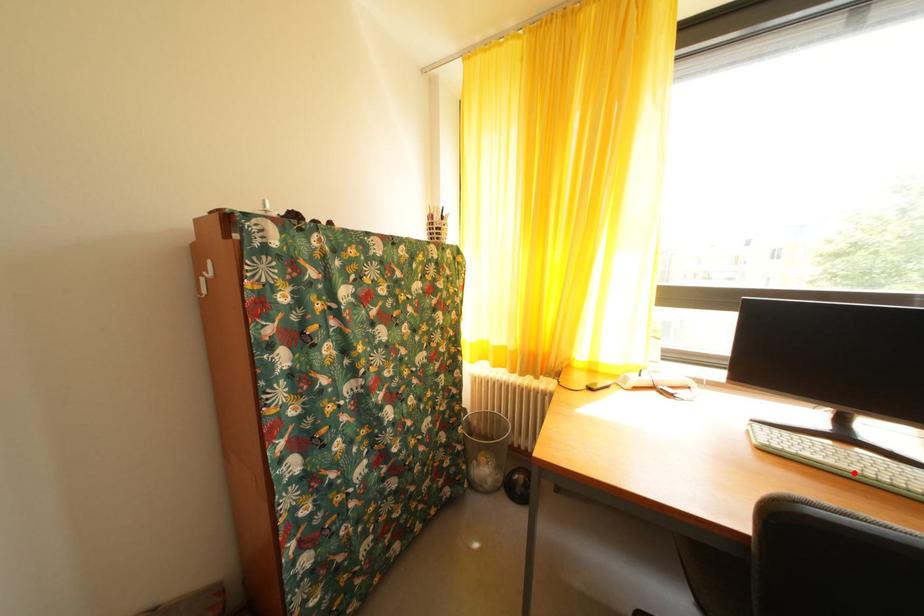
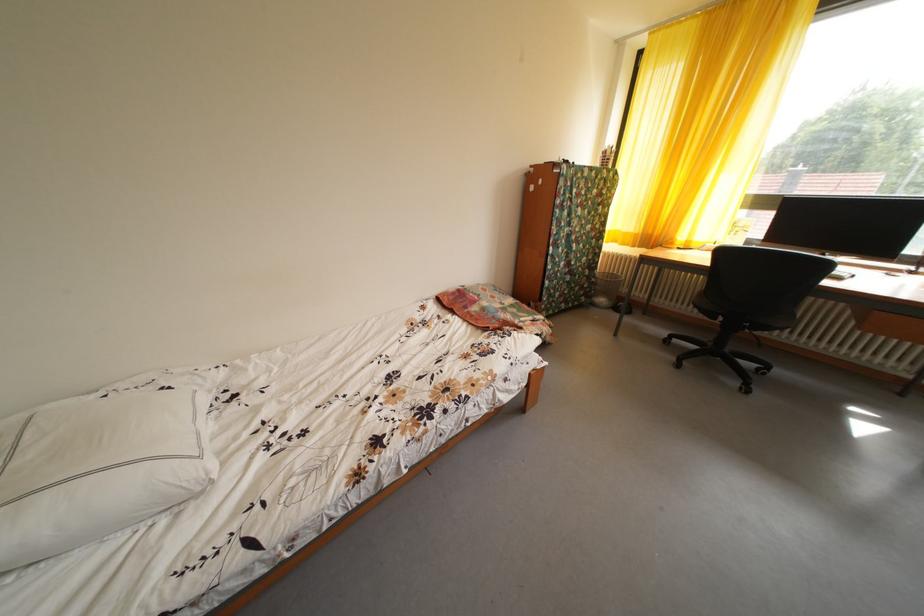
Question: I am providing you with two images of the same scene from different viewpoints. A red point is marked on the first image. Can you still see the location of the red point in image 2?

Choices:
 (A) Yes
 (B) No

Answer: (B)